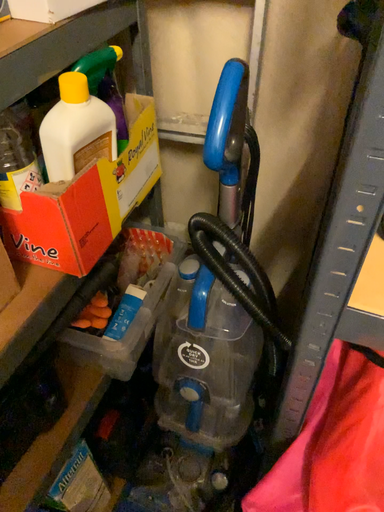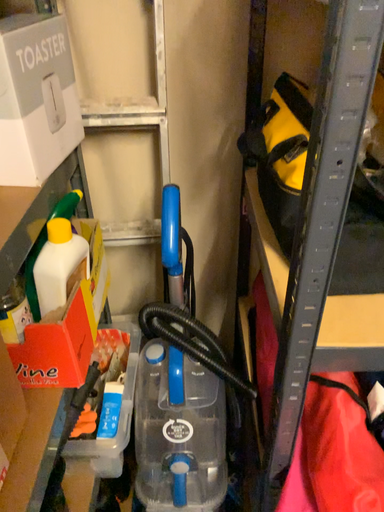
Question: Which way did the camera rotate in the video?

Choices:
 (A) rotated left
 (B) rotated right

Answer: (B)